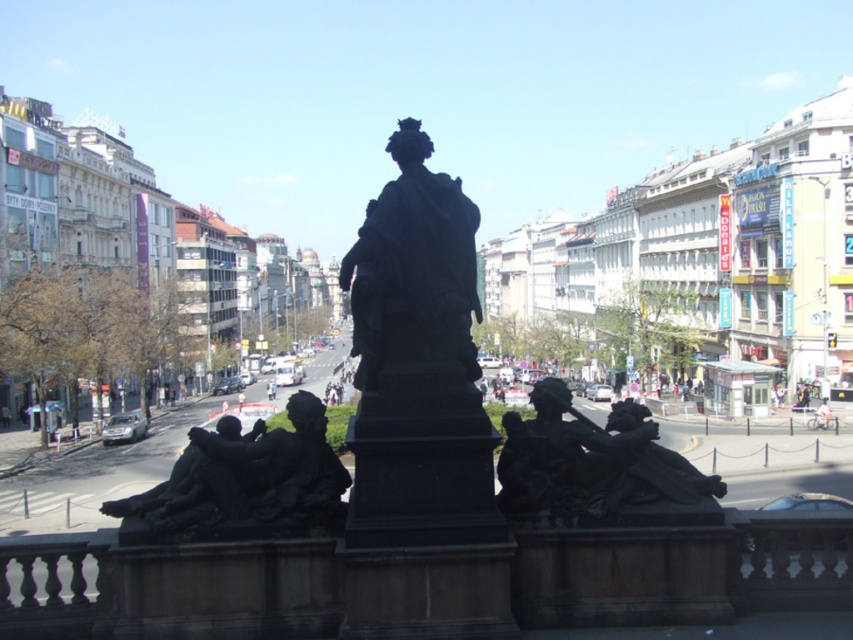
Based on the photo, is black polished statue at center further to the viewer compared to dark brown stone sculpture at lower right?

No, black polished statue at center is closer to the viewer.

Which of these two, black polished statue at center or dark brown stone sculpture at lower right, stands shorter?

dark brown stone sculpture at lower right

Describe the element at coordinates (421, 368) in the screenshot. The image size is (853, 640). I see `black polished statue at center` at that location.

Identify the location of black polished statue at center. The width and height of the screenshot is (853, 640). (421, 368).

Which of these two, dark brown stone sculpture at lower right or light blue fabric person at lower right, stands shorter?

With less height is light blue fabric person at lower right.

Between dark brown stone sculpture at lower right and light blue fabric person at lower right, which one has more height?

dark brown stone sculpture at lower right is taller.

Is point (549, 472) farther from viewer compared to point (809, 424)?

No, it is not.

The height and width of the screenshot is (640, 853). Identify the location of dark brown stone sculpture at lower right. (x=596, y=468).

Who is shorter, black polished statue at center or light blue fabric person at lower right?

light blue fabric person at lower right is shorter.

Is point (376, 436) more distant than point (827, 416)?

No, it is not.

I want to click on black polished statue at center, so click(x=421, y=368).